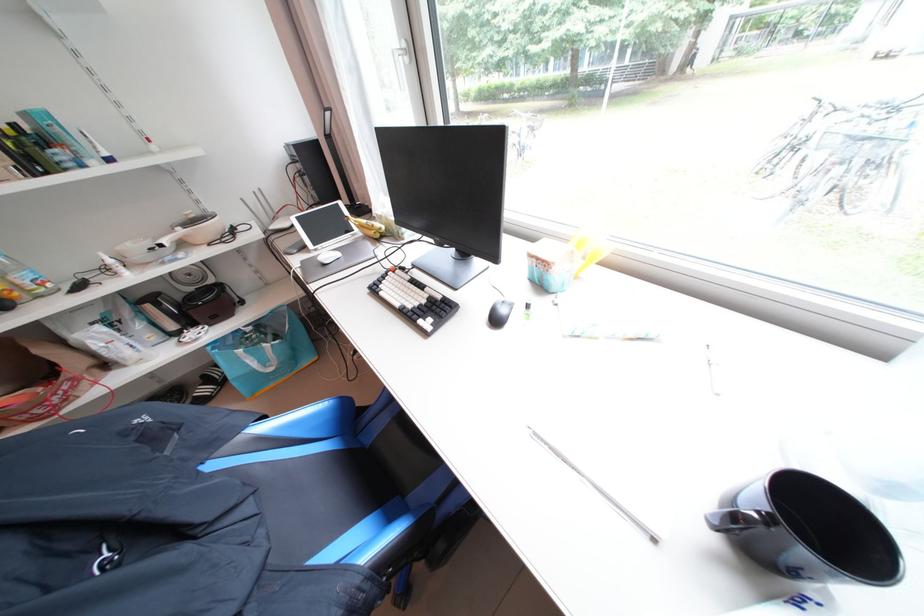
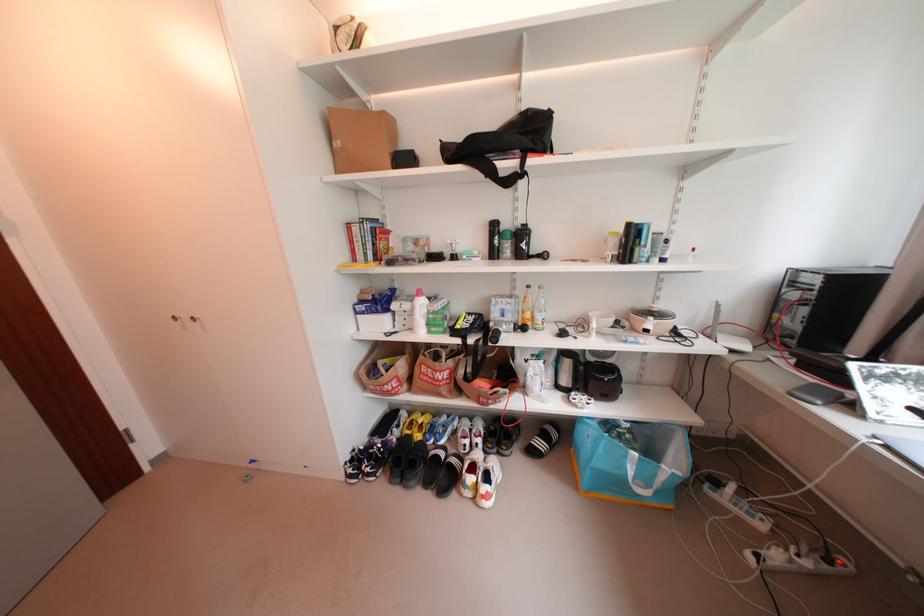
Find the pixel in the second image that matches pixel 188 229 in the first image.

(660, 320)